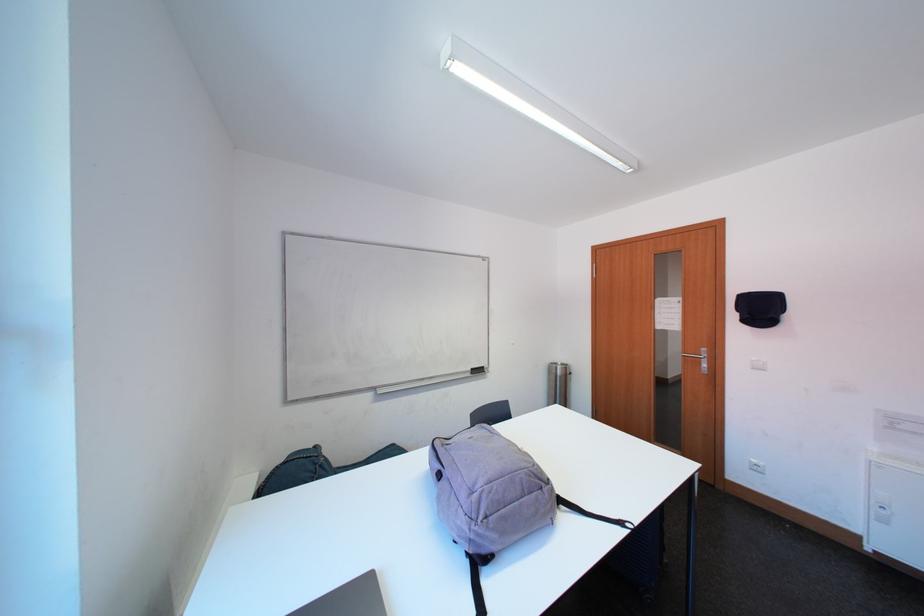
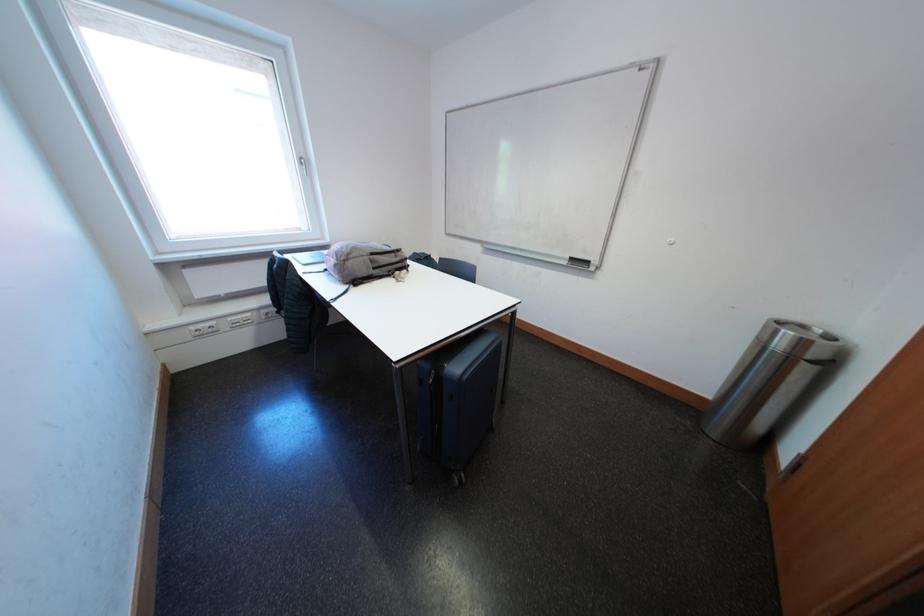
The point at [479,378] is marked in the first image. Where is the corresponding point in the second image?

(575, 267)